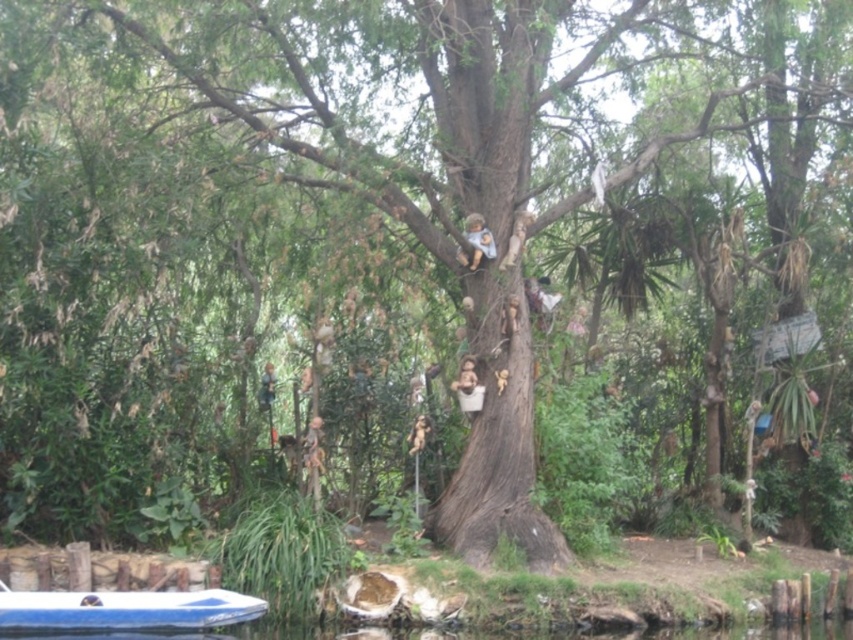
Between blue plastic boat at lower left and smooth beige doll at upper center, which one appears on the right side from the viewer's perspective?

From the viewer's perspective, smooth beige doll at upper center appears more on the right side.

Is blue plastic boat at lower left shorter than smooth beige doll at upper center?

Yes.

The image size is (853, 640). What do you see at coordinates (123, 611) in the screenshot?
I see `blue plastic boat at lower left` at bounding box center [123, 611].

Find the location of a particular element. blue plastic boat at lower left is located at coordinates (123, 611).

Between smooth beige doll at upper center and wooden doll at center, which one is positioned higher?

smooth beige doll at upper center

From the picture: Is smooth beige doll at upper center thinner than wooden doll at center?

No, smooth beige doll at upper center is not thinner than wooden doll at center.

Locate an element on the screen. This screenshot has width=853, height=640. smooth beige doll at upper center is located at coordinates (476, 241).

This screenshot has height=640, width=853. Identify the location of smooth beige doll at upper center. (476, 241).

Is blue plastic boat at lower left behind wooden doll at center?

No, it is in front of wooden doll at center.

Is blue plastic boat at lower left to the left of wooden doll at center from the viewer's perspective?

Indeed, blue plastic boat at lower left is positioned on the left side of wooden doll at center.

Describe the element at coordinates (123, 611) in the screenshot. I see `blue plastic boat at lower left` at that location.

Find the location of a particular element. This screenshot has height=640, width=853. blue plastic boat at lower left is located at coordinates (123, 611).